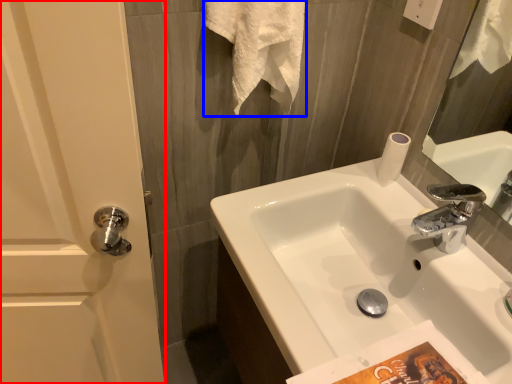
Question: Which point is further to the camera, screen door (highlighted by a red box) or bath towel (highlighted by a blue box)?

Choices:
 (A) screen door
 (B) bath towel

Answer: (B)